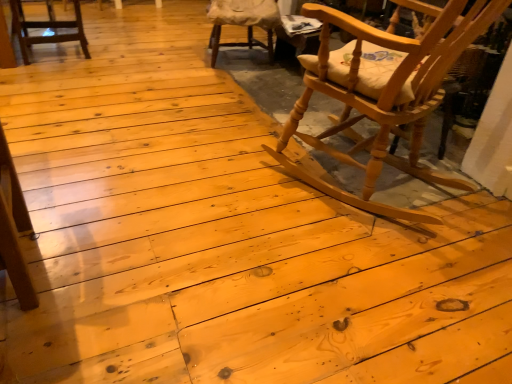
Locate an element on the screen. free point below wooden cushioned chair at upper center, positioned as the second chair in right-to-left order (from a real-world perspective) is located at coordinates (237, 57).